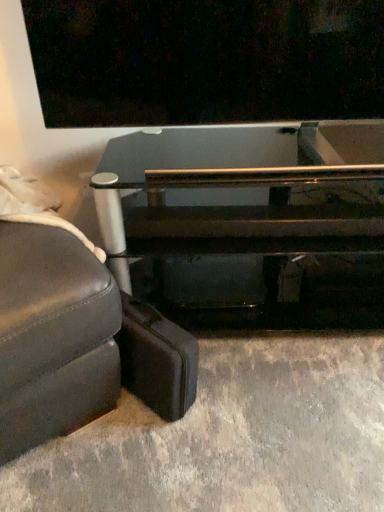
Question: Would you say leather studio couch at lower left is to the left or to the right of leather suitcase at lower left in the picture?

Choices:
 (A) right
 (B) left

Answer: (B)

Question: From the image's perspective, is leather studio couch at lower left positioned above or below leather suitcase at lower left?

Choices:
 (A) above
 (B) below

Answer: (A)

Question: Which object is positioned closest to the transparent glass table at center?

Choices:
 (A) leather studio couch at lower left
 (B) leather suitcase at lower left

Answer: (B)

Question: Based on their relative distances, which object is nearer to the transparent glass table at center?

Choices:
 (A) leather suitcase at lower left
 (B) leather studio couch at lower left

Answer: (A)